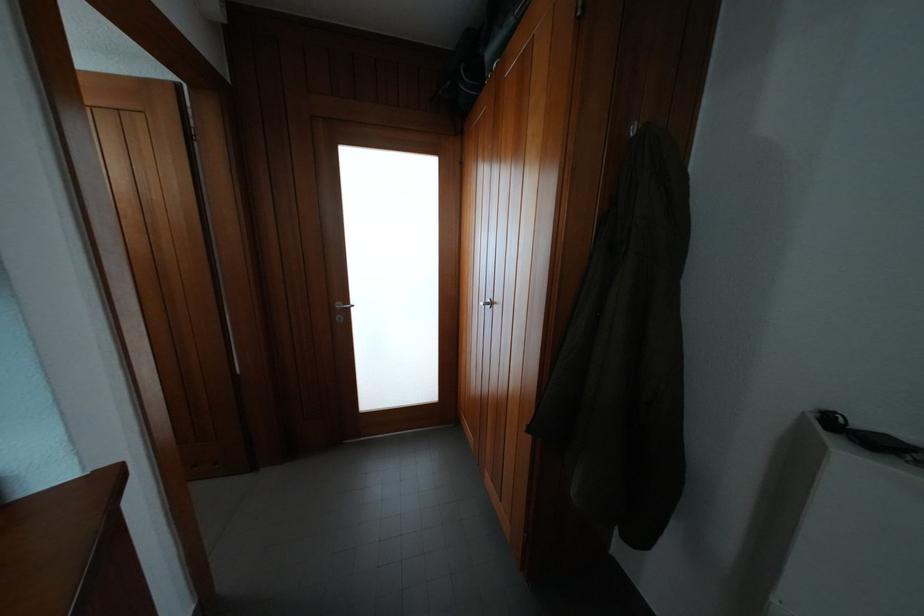
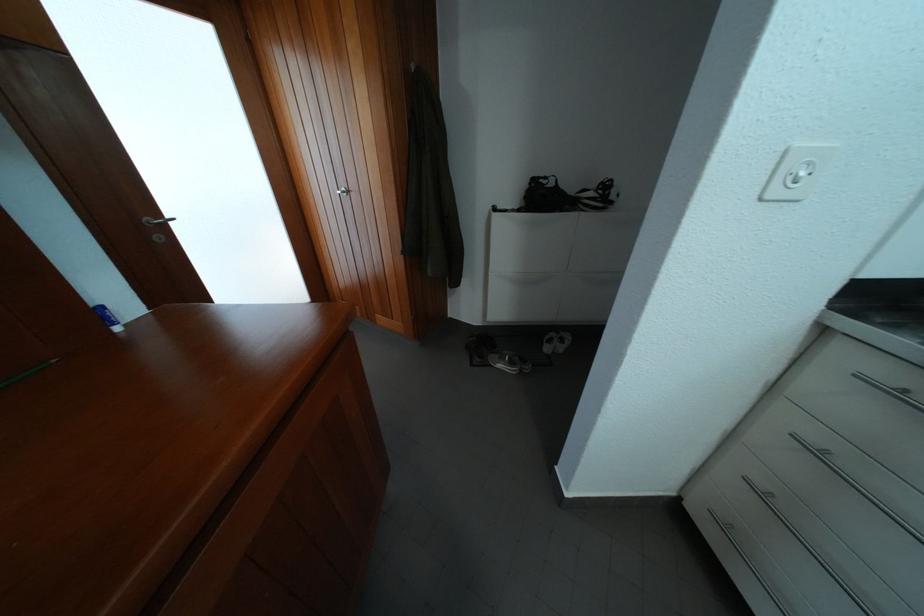
The images are taken continuously from a first-person perspective. In which direction is your viewpoint rotating?

The camera's rotation is toward right-down.